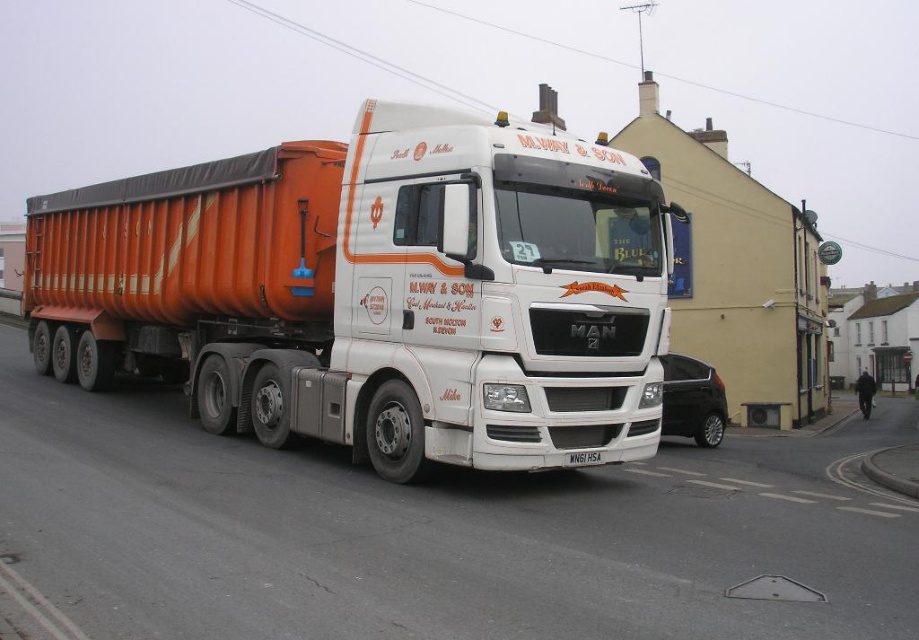
You are a delivery driver who needs to navigate a narrow alley that allows vehicles up to 2.5 meters in width. You are currently looking at the orange metallic trailer at left and the white plastic license plate at center. Can the trailer fit through the alley without hitting the sides?

The orange metallic trailer at left might be wider than white plastic license plate at center, so there is a possibility that the trailer could be wider than the 2.5 meters allowed by the alley. The driver should check the exact width of the trailer before proceeding.

You are standing at the center of the street in front of the lorry. You need to locate the orange metallic trailer at left. According to the scene, where would you look relative to your position?

The orange metallic trailer at left is located at the left side of the lorry, so you should look to your left relative to your position in front of the lorry.

You are a delivery driver who needs to ensure the orange metallic trailer at left is not blocking the white plastic license plate at center for identification purposes. Is the trailer currently obscuring the license plate?

The orange metallic trailer at left is positioned over the white plastic license plate at center, so yes, the trailer is currently obscuring the license plate.